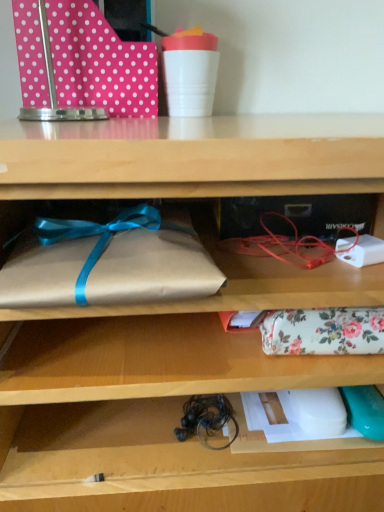
The image size is (384, 512). What are the coordinates of `floral fabric pouch at center, which is the first wrap in back-to-front order` in the screenshot? It's located at (323, 331).

What is the approximate height of floral fabric pouch at center, which is the first wrap in back-to-front order?

2.58 inches.

What do you see at coordinates (205, 418) in the screenshot? The height and width of the screenshot is (512, 384). I see `black rubber twine at lower center` at bounding box center [205, 418].

Where is `pink polka dot wrapping paper at upper left`? pink polka dot wrapping paper at upper left is located at coordinates (80, 64).

What is the approximate height of brown paper wrapped at left, which is the 2th wrap from bottom to top?

brown paper wrapped at left, which is the 2th wrap from bottom to top, is 2.69 inches in height.

In order to click on floral fabric pouch at center, which is the 2th wrap from front to back in this screenshot , I will do `click(323, 331)`.

Where is `twine located below the pink polka dot wrapping paper at upper left (from the image's perspective)`? Image resolution: width=384 pixels, height=512 pixels. twine located below the pink polka dot wrapping paper at upper left (from the image's perspective) is located at coordinates (205, 418).

Which of these two, black rubber twine at lower center or pink polka dot wrapping paper at upper left, is thinner?

black rubber twine at lower center.

Is black rubber twine at lower center oriented towards pink polka dot wrapping paper at upper left?

No, black rubber twine at lower center is not facing towards pink polka dot wrapping paper at upper left.

Can you confirm if black rubber twine at lower center is shorter than pink polka dot wrapping paper at upper left?

Indeed, black rubber twine at lower center has a lesser height compared to pink polka dot wrapping paper at upper left.

Considering the relative sizes of black rubber twine at lower center and brown paper wrapped at left, which is the 2th wrap from bottom to top, in the image provided, is black rubber twine at lower center shorter than brown paper wrapped at left, which is the 2th wrap from bottom to top,?

Correct, black rubber twine at lower center is not as tall as brown paper wrapped at left, which is the 2th wrap from bottom to top.

From the picture: Is brown paper wrapped at left, acting as the 2th wrap starting from the back, completely or partially inside black rubber twine at lower center?

Definitely not — brown paper wrapped at left, acting as the 2th wrap starting from the back, is not inside black rubber twine at lower center.

Considering the points (195, 407) and (152, 270), which point is behind, point (195, 407) or point (152, 270)?

Point (195, 407)

Which is in front, pink polka dot wrapping paper at upper left or black rubber twine at lower center?

black rubber twine at lower center.

Can you confirm if pink polka dot wrapping paper at upper left is bigger than black rubber twine at lower center?

Indeed, pink polka dot wrapping paper at upper left has a larger size compared to black rubber twine at lower center.

Looking at this image, is pink polka dot wrapping paper at upper left facing towards black rubber twine at lower center?

No.

Can you tell me how much brown paper wrapped at left, which is the first wrap from left to right, and pink polka dot wrapping paper at upper left differ in facing direction?

brown paper wrapped at left, which is the first wrap from left to right, and pink polka dot wrapping paper at upper left are facing 2.94 degrees away from each other.

Considering their positions, is brown paper wrapped at left, which is the first wrap from left to right, located in front of or behind pink polka dot wrapping paper at upper left?

brown paper wrapped at left, which is the first wrap from left to right, is positioned closer to the viewer than pink polka dot wrapping paper at upper left.

Based on the photo, does brown paper wrapped at left, which is counted as the 2th wrap, starting from the right, appear on the right side of pink polka dot wrapping paper at upper left?

Correct, you'll find brown paper wrapped at left, which is counted as the 2th wrap, starting from the right, to the right of pink polka dot wrapping paper at upper left.

Are pink polka dot wrapping paper at upper left and floral fabric pouch at center, which is counted as the 2th wrap, starting from the left, located far from each other?

pink polka dot wrapping paper at upper left is near floral fabric pouch at center, which is counted as the 2th wrap, starting from the left, not far away.

Considering the relative sizes of pink polka dot wrapping paper at upper left and floral fabric pouch at center, the first wrap in the right-to-left sequence, in the image provided, is pink polka dot wrapping paper at upper left wider than floral fabric pouch at center, the first wrap in the right-to-left sequence,?

Yes.

Considering the relative sizes of pink polka dot wrapping paper at upper left and floral fabric pouch at center, which is the 2th wrap from front to back, in the image provided, is pink polka dot wrapping paper at upper left taller than floral fabric pouch at center, which is the 2th wrap from front to back,?

Indeed, pink polka dot wrapping paper at upper left has a greater height compared to floral fabric pouch at center, which is the 2th wrap from front to back.

Considering the relative sizes of pink polka dot wrapping paper at upper left and floral fabric pouch at center, which is the 2th wrap from front to back, in the image provided, is pink polka dot wrapping paper at upper left smaller than floral fabric pouch at center, which is the 2th wrap from front to back,?

Incorrect, pink polka dot wrapping paper at upper left is not smaller in size than floral fabric pouch at center, which is the 2th wrap from front to back.

Between floral fabric pouch at center, which is counted as the 2th wrap, starting from the left, and pink polka dot wrapping paper at upper left, which one appears on the left side from the viewer's perspective?

From the viewer's perspective, pink polka dot wrapping paper at upper left appears more on the left side.

From a real-world perspective, is floral fabric pouch at center, marked as the first wrap in a bottom-to-top arrangement, over pink polka dot wrapping paper at upper left?

Incorrect, from a real-world perspective, floral fabric pouch at center, marked as the first wrap in a bottom-to-top arrangement, is lower than pink polka dot wrapping paper at upper left.

Which of these two, pink polka dot wrapping paper at upper left or brown paper wrapped at left, acting as the 1th wrap starting from the top, stands taller?

Standing taller between the two is pink polka dot wrapping paper at upper left.

Does pink polka dot wrapping paper at upper left have a larger size compared to brown paper wrapped at left, acting as the 2th wrap starting from the back?

Correct, pink polka dot wrapping paper at upper left is larger in size than brown paper wrapped at left, acting as the 2th wrap starting from the back.

Considering the sizes of pink polka dot wrapping paper at upper left and brown paper wrapped at left, acting as the 1th wrap starting from the top, in the image, is pink polka dot wrapping paper at upper left wider or thinner than brown paper wrapped at left, acting as the 1th wrap starting from the top,?

Considering their sizes, pink polka dot wrapping paper at upper left looks slimmer than brown paper wrapped at left, acting as the 1th wrap starting from the top.

Is pink polka dot wrapping paper at upper left directly adjacent to brown paper wrapped at left, which is the 2th wrap from bottom to top?

No, pink polka dot wrapping paper at upper left is not beside brown paper wrapped at left, which is the 2th wrap from bottom to top.

Locate an element on the screen. Image resolution: width=384 pixels, height=512 pixels. wrapping paper located behind the black rubber twine at lower center is located at coordinates (80, 64).

The height and width of the screenshot is (512, 384). Identify the location of wrap on the left of black rubber twine at lower center. (109, 261).

Estimate the real-world distances between objects in this image. Which object is further from pink polka dot wrapping paper at upper left, brown paper wrapped at left, which is the 1th wrap from front to back, or floral fabric pouch at center, which is the first wrap in back-to-front order?

Based on the image, floral fabric pouch at center, which is the first wrap in back-to-front order, appears to be further to pink polka dot wrapping paper at upper left.

Looking at the image, which one is located closer to floral fabric pouch at center, which is the 2th wrap from front to back, brown paper wrapped at left, which is the 1th wrap from front to back, or pink polka dot wrapping paper at upper left?

Among the two, brown paper wrapped at left, which is the 1th wrap from front to back, is located nearer to floral fabric pouch at center, which is the 2th wrap from front to back.

Which object lies nearer to the anchor point brown paper wrapped at left, which is the 1th wrap from front to back, pink polka dot wrapping paper at upper left or floral fabric pouch at center, which is counted as the 2th wrap, starting from the left?

floral fabric pouch at center, which is counted as the 2th wrap, starting from the left, lies closer to brown paper wrapped at left, which is the 1th wrap from front to back, than the other object.

Which object lies further to the anchor point pink polka dot wrapping paper at upper left, black rubber twine at lower center or floral fabric pouch at center, which is counted as the 2th wrap, starting from the left?

Among the two, black rubber twine at lower center is located further to pink polka dot wrapping paper at upper left.

Estimate the real-world distances between objects in this image. Which object is further from floral fabric pouch at center, marked as the first wrap in a bottom-to-top arrangement, pink polka dot wrapping paper at upper left or brown paper wrapped at left, acting as the 2th wrap starting from the back?

pink polka dot wrapping paper at upper left is further to floral fabric pouch at center, marked as the first wrap in a bottom-to-top arrangement.

Estimate the real-world distances between objects in this image. Which object is further from brown paper wrapped at left, which is the first wrap from left to right, pink polka dot wrapping paper at upper left or black rubber twine at lower center?

black rubber twine at lower center lies further to brown paper wrapped at left, which is the first wrap from left to right, than the other object.

From the image, which object appears to be nearer to floral fabric pouch at center, marked as the first wrap in a bottom-to-top arrangement, brown paper wrapped at left, which is counted as the 2th wrap, starting from the right, or black rubber twine at lower center?

black rubber twine at lower center lies closer to floral fabric pouch at center, marked as the first wrap in a bottom-to-top arrangement, than the other object.

Estimate the real-world distances between objects in this image. Which object is further from pink polka dot wrapping paper at upper left, black rubber twine at lower center or brown paper wrapped at left, which is the 2th wrap from bottom to top?

The object further to pink polka dot wrapping paper at upper left is black rubber twine at lower center.

Where is `wrap between pink polka dot wrapping paper at upper left and floral fabric pouch at center, which is the first wrap in back-to-front order, vertically`? The height and width of the screenshot is (512, 384). wrap between pink polka dot wrapping paper at upper left and floral fabric pouch at center, which is the first wrap in back-to-front order, vertically is located at coordinates (109, 261).

Where is `twine between brown paper wrapped at left, which is the 2th wrap from bottom to top, and floral fabric pouch at center, which is the first wrap in back-to-front order, in the horizontal direction`? This screenshot has height=512, width=384. twine between brown paper wrapped at left, which is the 2th wrap from bottom to top, and floral fabric pouch at center, which is the first wrap in back-to-front order, in the horizontal direction is located at coordinates (205, 418).